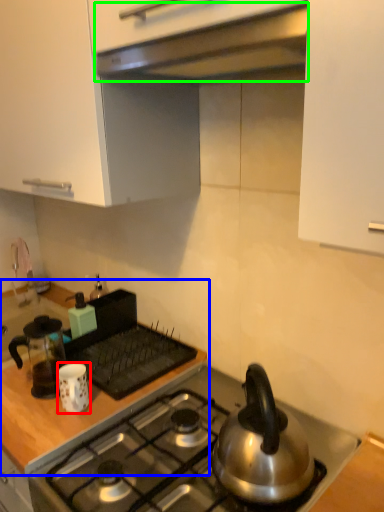
Question: Estimate the real-world distances between objects in this image. Which object is closer to kitchen appliance (highlighted by a red box), countertop (highlighted by a blue box) or exhaust hood (highlighted by a green box)?

Choices:
 (A) countertop
 (B) exhaust hood

Answer: (A)